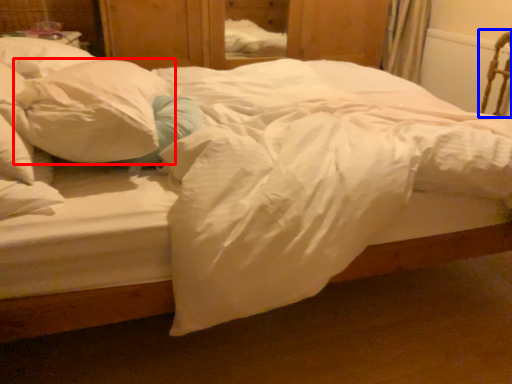
Question: Which of the following is the closest to the observer, pillow (highlighted by a red box) or armchair (highlighted by a blue box)?

Choices:
 (A) pillow
 (B) armchair

Answer: (A)